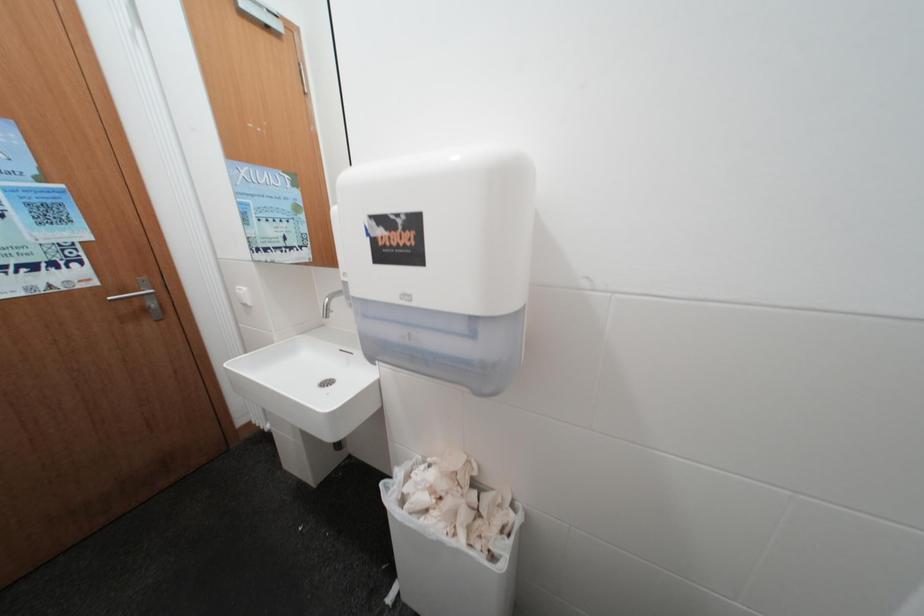
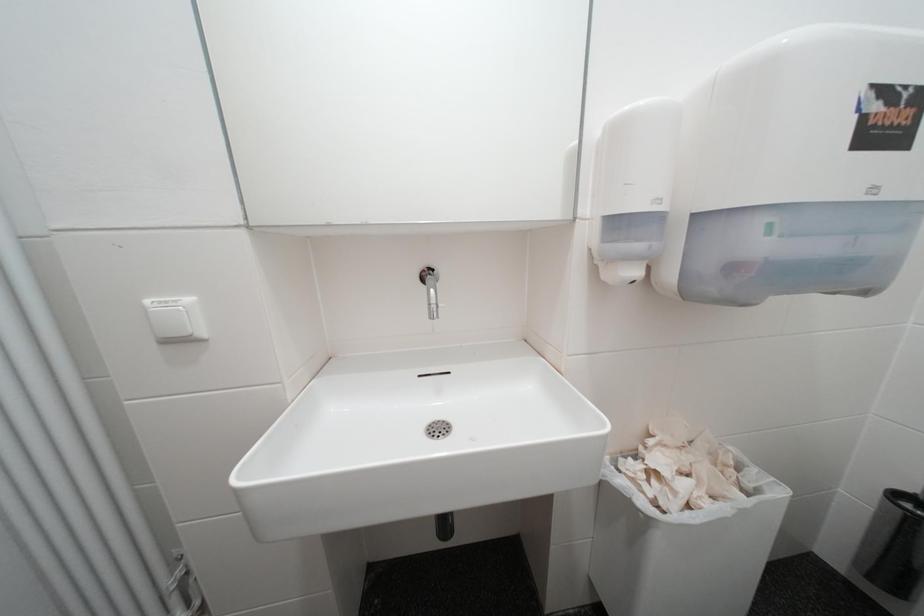
Question: Based on the continuous images, in which direction is the camera rotating? Reply with the corresponding letter.

Choices:
 (A) Left
 (B) Right
 (C) Up
 (D) Down

Answer: (B)